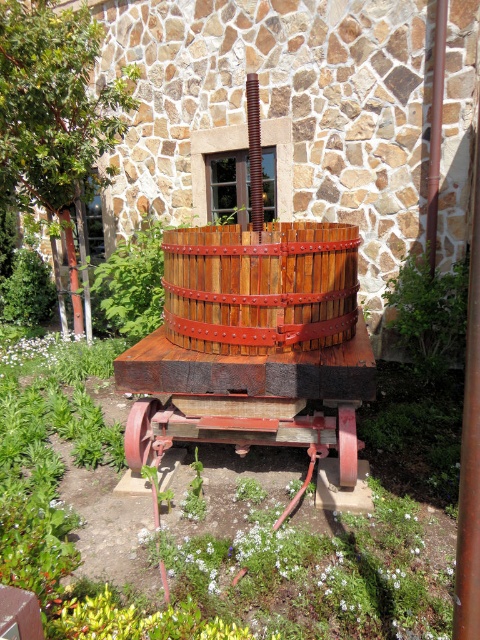
I want to click on wooden barrel at center, so click(x=261, y=285).

Who is taller, wooden barrel at center or rustic wood wheel at center?

Standing taller between the two is wooden barrel at center.

Between point (228, 282) and point (151, 413), which one is positioned behind?

The point (151, 413) is behind.

This screenshot has width=480, height=640. Identify the location of wooden barrel at center. (261, 285).

Can you confirm if wooden barrel at center is positioned to the left of white matte flower at center?

Incorrect, wooden barrel at center is not on the left side of white matte flower at center.

Locate an element on the screen. wooden barrel at center is located at coordinates point(261,285).

Where is `wooden barrel at center`? wooden barrel at center is located at coordinates (261, 285).

Which is below, white matte flower at center or rustic wood wheel at center?

rustic wood wheel at center is lower down.

Is white matte flower at center to the left of rustic wood wheel at center from the viewer's perspective?

Indeed, white matte flower at center is positioned on the left side of rustic wood wheel at center.

I want to click on white matte flower at center, so click(x=34, y=348).